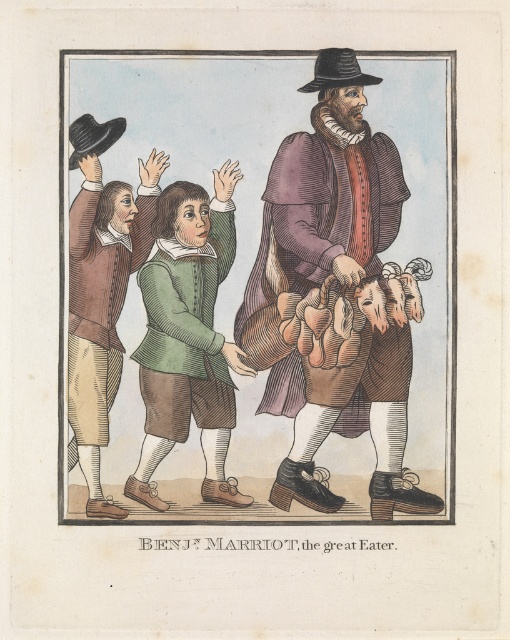
Which of these two, brown leather coat at center or matte brown vest at left, stands taller?

brown leather coat at center is taller.

Between brown leather coat at center and matte brown vest at left, which one is positioned lower?

matte brown vest at left is below.

Which is in front, point (380, 132) or point (103, 371)?

Point (103, 371) is more forward.

Where is `brown leather coat at center`? The width and height of the screenshot is (510, 640). brown leather coat at center is located at coordinates (336, 296).

Is brown leather coat at center thinner than green velvet vest at center?

No.

Who is positioned more to the left, brown leather coat at center or green velvet vest at center?

green velvet vest at center

You are a GUI agent. You are given a task and a screenshot of the screen. Output one action in this format:
    pyautogui.click(x=<x>, y=<y>)
    Task: Click on the brown leather coat at center
    
    Given the screenshot: What is the action you would take?
    pyautogui.click(x=336, y=296)

Which is above, green velvet vest at center or matte brown vest at left?

matte brown vest at left is higher up.

Does point (211, 308) lie in front of point (110, 356)?

No, it is not.

Who is more forward, (187, 211) or (145, 216)?

Point (187, 211) is in front.

Identify the location of green velvet vest at center. (188, 337).